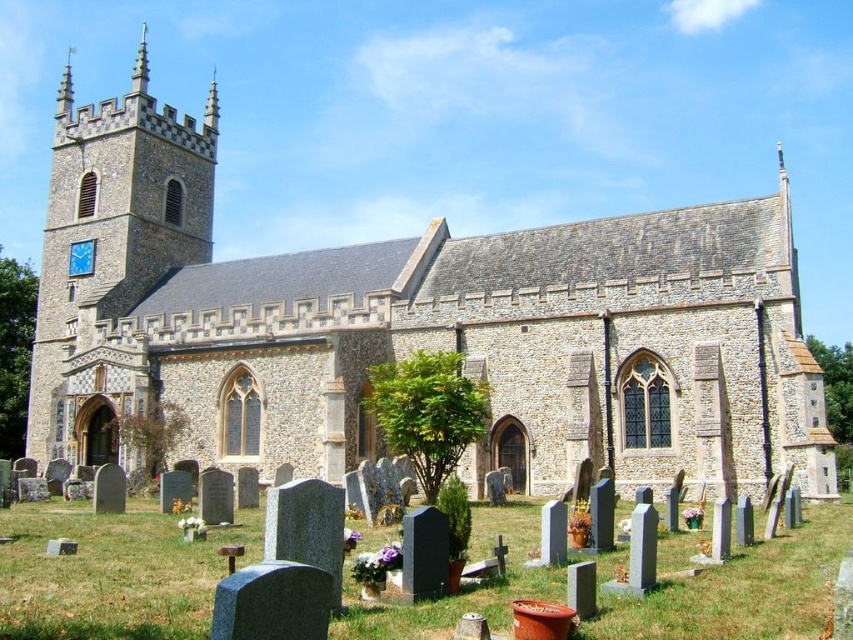
You are standing at the point marked by coordinates point (x=415, y=326). Which object are you closest to?

You are closest to the stone church at center because the point (x=415, y=326) marks its location.

You are a photographer wanting to capture the stone church at center and the smooth stone spire at upper left in a single frame. Given their heights, which one will appear larger in your photo?

The stone church at center is much taller than the smooth stone spire at upper left, so it will appear larger in the photo.

Looking at this image, you are a tourist visiting the church and want to take a photo that includes both the stone church at center and the smooth stone spire at upper left. Based on their sizes, which object should you focus on to ensure both are visible in the frame?

The stone church at center is larger than the smooth stone spire at upper left, so focusing on the stone church at center will allow both to be visible in the frame since it occupies more space.